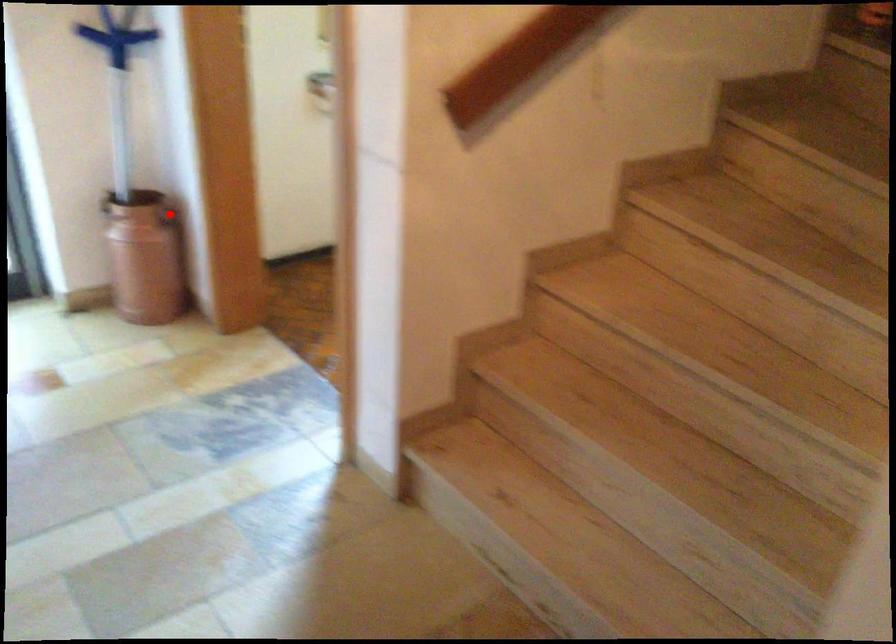
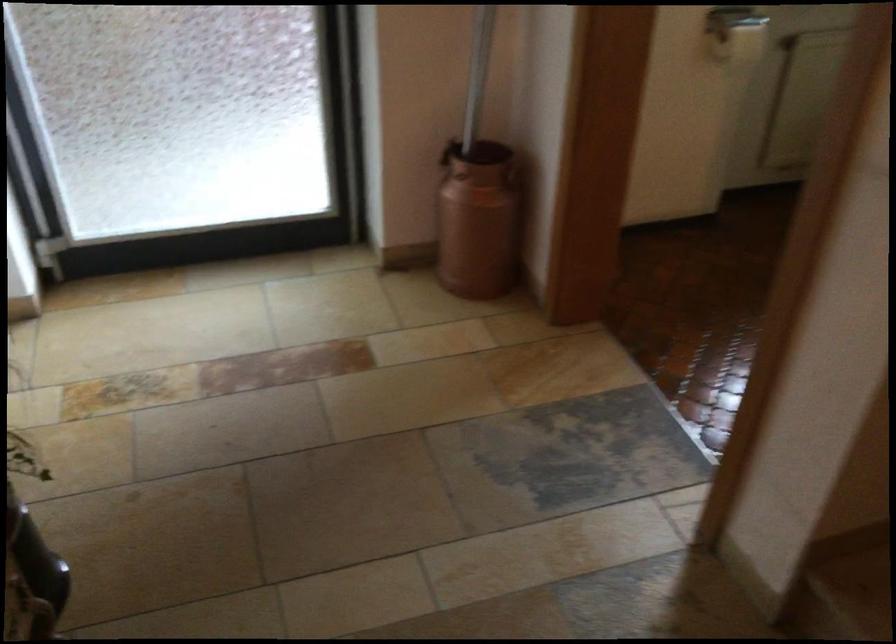
Question: I am providing you with two images of the same scene from different viewpoints. Image1 has a red point marked. In image2, the corresponding 3D location appears at what relative position? Reply with the corresponding letter.

Choices:
 (A) Closer
 (B) Farther

Answer: (A)